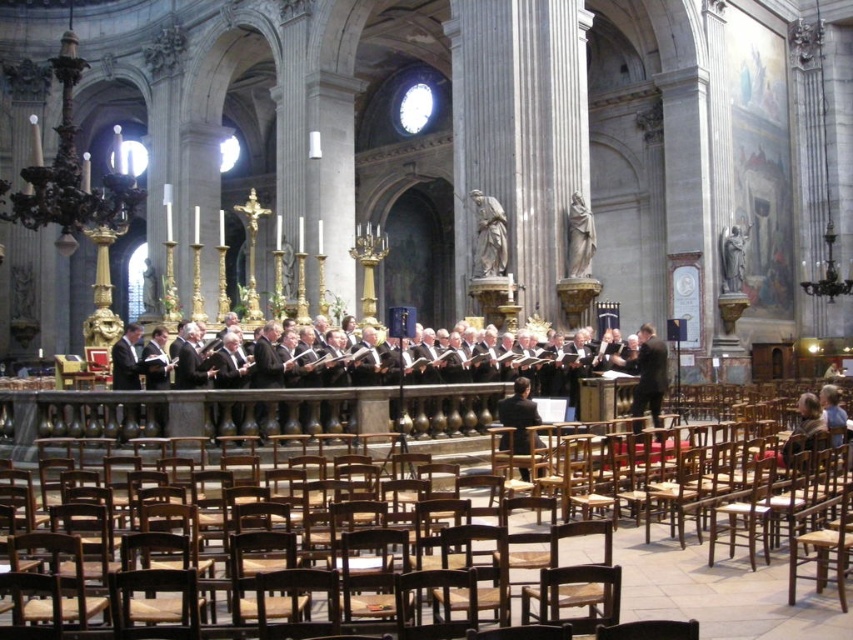
Measure the distance between wooden chair at center and black suit at right.

wooden chair at center and black suit at right are 11.32 meters apart from each other.

Who is more distant from viewer, (109, 406) or (641, 426)?

The point (641, 426) is more distant.

Locate an element on the screen. wooden chair at center is located at coordinates (718, 589).

Locate an element on the screen. The height and width of the screenshot is (640, 853). wooden chair at center is located at coordinates (718, 589).

Is wooden chair at center shorter than black glossy suit at center?

Incorrect, wooden chair at center's height does not fall short of black glossy suit at center's.

Measure the distance between wooden chair at center and black glossy suit at center.

wooden chair at center and black glossy suit at center are 3.92 meters apart.

Is point (720, 568) closer to camera compared to point (238, 365)?

That is True.

You are a GUI agent. You are given a task and a screenshot of the screen. Output one action in this format:
    pyautogui.click(x=<x>, y=<y>)
    Task: Click on the wooden chair at center
    Image resolution: width=853 pixels, height=640 pixels.
    Given the screenshot: What is the action you would take?
    click(718, 589)

In the scene shown: Does black glossy suit at center appear over white marble statue at center-right?

Incorrect, black glossy suit at center is not positioned above white marble statue at center-right.

Which is behind, point (570, 355) or point (573, 205)?

Point (573, 205)

The height and width of the screenshot is (640, 853). Identify the location of black glossy suit at center. (308, 401).

Where is `black glossy suit at center`? black glossy suit at center is located at coordinates (308, 401).